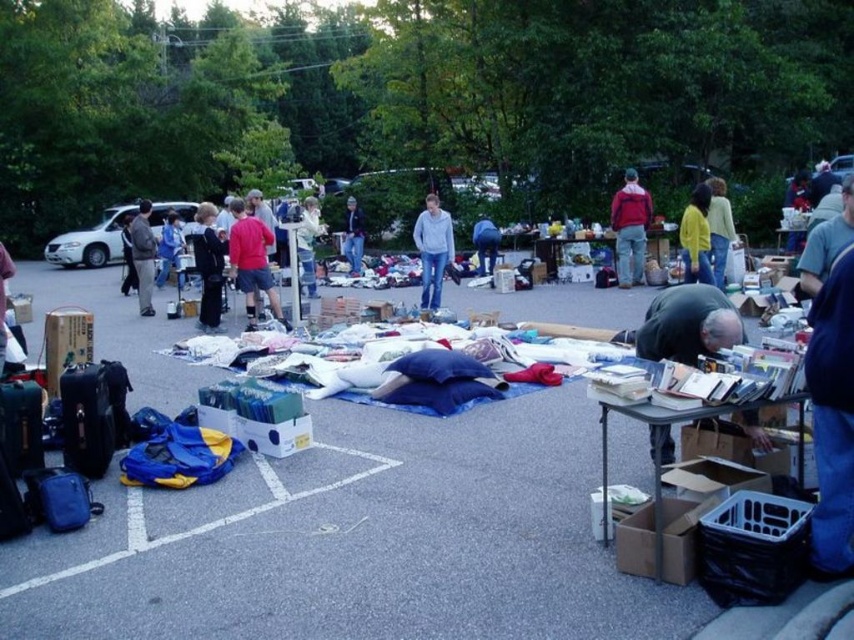
You are a customer at the flea market and want to know which item is closer to the ground between the blue fabric pillows at center and the light blue denim jeans at center. Which one is it?

The blue fabric pillows at center is shorter than light blue denim jeans at center, so the blue fabric pillows at center is closer to the ground.

You are organizing a charity event and need to decide which items to display first. If you have the blue fabric pillows at center and the white cotton shirt at center, which item should you choose to place on the main display table to attract more attention based on their sizes?

The blue fabric pillows at center is larger in size than the white cotton shirt at center, so it would be more noticeable and should be placed on the main display table first to attract attention.